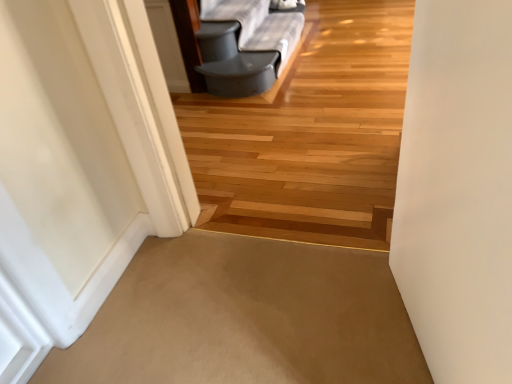
Measure the distance between point (x=395, y=357) and camera.

Point (x=395, y=357) and camera are 3.72 feet apart.

In order to face beige carpet at center, the 2th path viewed from the top, should I rotate leftwards or rightwards?

A 1.720 degree turn to the left will do.

What do you see at coordinates (246, 318) in the screenshot?
I see `beige carpet at center, the 1th path ordered from the bottom` at bounding box center [246, 318].

Where is `beige carpet at center, the 1th path ordered from the bottom`? The width and height of the screenshot is (512, 384). beige carpet at center, the 1th path ordered from the bottom is located at coordinates (246, 318).

Describe the element at coordinates (310, 134) in the screenshot. I see `wooden floor at center, the 2th path when ordered from bottom to top` at that location.

The height and width of the screenshot is (384, 512). I want to click on wooden floor at center, the first path from the top, so click(310, 134).

Where is `beige carpet at center, the 1th path ordered from the bottom`? Image resolution: width=512 pixels, height=384 pixels. beige carpet at center, the 1th path ordered from the bottom is located at coordinates (246, 318).

Is beige carpet at center, the 2th path viewed from the top, to the right of wooden floor at center, the first path from the top, from the viewer's perspective?

No.

Who is more distant, beige carpet at center, the 2th path viewed from the top, or wooden floor at center, the 2th path when ordered from bottom to top?

beige carpet at center, the 2th path viewed from the top, is further away from the camera.

Is point (365, 272) more distant than point (298, 71)?

That is False.

From the image's perspective, is beige carpet at center, the 1th path ordered from the bottom, on top of wooden floor at center, the 2th path when ordered from bottom to top?

No, from the image's perspective, beige carpet at center, the 1th path ordered from the bottom, is not on top of wooden floor at center, the 2th path when ordered from bottom to top.

From a real-world perspective, between beige carpet at center, the 1th path ordered from the bottom, and wooden floor at center, the 2th path when ordered from bottom to top, who is vertically lower?

beige carpet at center, the 1th path ordered from the bottom.

Looking at their sizes, would you say beige carpet at center, the 2th path viewed from the top, is wider or thinner than wooden floor at center, the first path from the top?

beige carpet at center, the 2th path viewed from the top, is wider than wooden floor at center, the first path from the top.

Between beige carpet at center, the 2th path viewed from the top, and wooden floor at center, the 2th path when ordered from bottom to top, which one has more height?

With more height is wooden floor at center, the 2th path when ordered from bottom to top.

Considering the sizes of beige carpet at center, the 1th path ordered from the bottom, and wooden floor at center, the 2th path when ordered from bottom to top, in the image, is beige carpet at center, the 1th path ordered from the bottom, bigger or smaller than wooden floor at center, the 2th path when ordered from bottom to top,?

beige carpet at center, the 1th path ordered from the bottom, is smaller than wooden floor at center, the 2th path when ordered from bottom to top.

Would you say beige carpet at center, the 2th path viewed from the top, contains wooden floor at center, the 2th path when ordered from bottom to top?

Definitely not — wooden floor at center, the 2th path when ordered from bottom to top, is not inside beige carpet at center, the 2th path viewed from the top.

Is beige carpet at center, the 2th path viewed from the top, directly adjacent to wooden floor at center, the first path from the top?

No, beige carpet at center, the 2th path viewed from the top, is not touching wooden floor at center, the first path from the top.

Is beige carpet at center, the 1th path ordered from the bottom, facing away from wooden floor at center, the first path from the top?

No, beige carpet at center, the 1th path ordered from the bottom,'s orientation is not away from wooden floor at center, the first path from the top.

What are the coordinates of `path on the left of wooden floor at center, the 2th path when ordered from bottom to top` in the screenshot? It's located at (246, 318).

Which is more to the right, wooden floor at center, the 2th path when ordered from bottom to top, or beige carpet at center, the 1th path ordered from the bottom?

wooden floor at center, the 2th path when ordered from bottom to top.

In the image, is wooden floor at center, the first path from the top, positioned in front of or behind beige carpet at center, the 1th path ordered from the bottom?

In the image, wooden floor at center, the first path from the top, appears in front of beige carpet at center, the 1th path ordered from the bottom.

Is point (270, 171) closer or farther from the camera than point (381, 328)?

Point (270, 171).

From the image's perspective, between wooden floor at center, the first path from the top, and beige carpet at center, the 2th path viewed from the top, who is located below?

beige carpet at center, the 2th path viewed from the top.

From a real-world perspective, relative to beige carpet at center, the 1th path ordered from the bottom, is wooden floor at center, the 2th path when ordered from bottom to top, vertically above or below?

wooden floor at center, the 2th path when ordered from bottom to top, is situated higher than beige carpet at center, the 1th path ordered from the bottom, in the real world.

Does wooden floor at center, the first path from the top, have a greater width compared to beige carpet at center, the 2th path viewed from the top?

No, wooden floor at center, the first path from the top, is not wider than beige carpet at center, the 2th path viewed from the top.

Is wooden floor at center, the 2th path when ordered from bottom to top, taller or shorter than beige carpet at center, the 2th path viewed from the top?

wooden floor at center, the 2th path when ordered from bottom to top, is taller than beige carpet at center, the 2th path viewed from the top.

Looking at this image, based on their sizes in the image, would you say wooden floor at center, the first path from the top, is bigger or smaller than beige carpet at center, the 1th path ordered from the bottom?

Clearly, wooden floor at center, the first path from the top, is larger in size than beige carpet at center, the 1th path ordered from the bottom.

Is wooden floor at center, the 2th path when ordered from bottom to top, located outside beige carpet at center, the 2th path viewed from the top?

Yes.

Is wooden floor at center, the 2th path when ordered from bottom to top, positioned far away from beige carpet at center, the 2th path viewed from the top?

No, wooden floor at center, the 2th path when ordered from bottom to top, is not far away from beige carpet at center, the 2th path viewed from the top.

Could you tell me if wooden floor at center, the 2th path when ordered from bottom to top, is facing beige carpet at center, the 2th path viewed from the top?

Yes, wooden floor at center, the 2th path when ordered from bottom to top, is oriented towards beige carpet at center, the 2th path viewed from the top.

How many degrees apart are the facing directions of wooden floor at center, the first path from the top, and beige carpet at center, the 1th path ordered from the bottom?

88.6 degrees.

The width and height of the screenshot is (512, 384). In the image, there is a wooden floor at center, the 2th path when ordered from bottom to top. Find the location of `path below it (from the image's perspective)`. path below it (from the image's perspective) is located at coordinates (246, 318).

Image resolution: width=512 pixels, height=384 pixels. What are the coordinates of `path that is above the beige carpet at center, the 1th path ordered from the bottom (from a real-world perspective)` in the screenshot? It's located at (310, 134).

Locate an element on the screen. This screenshot has height=384, width=512. path above the beige carpet at center, the 2th path viewed from the top (from the image's perspective) is located at coordinates (310, 134).